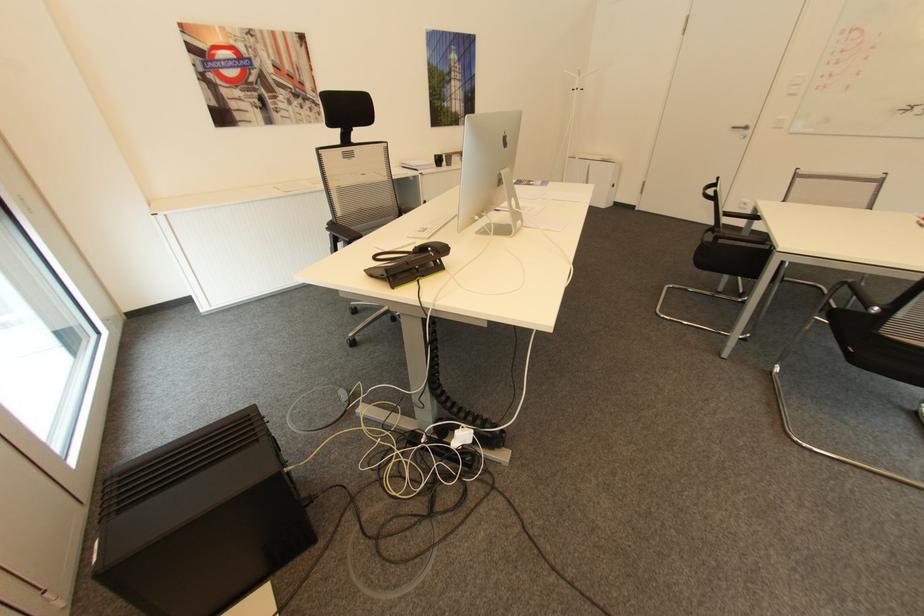
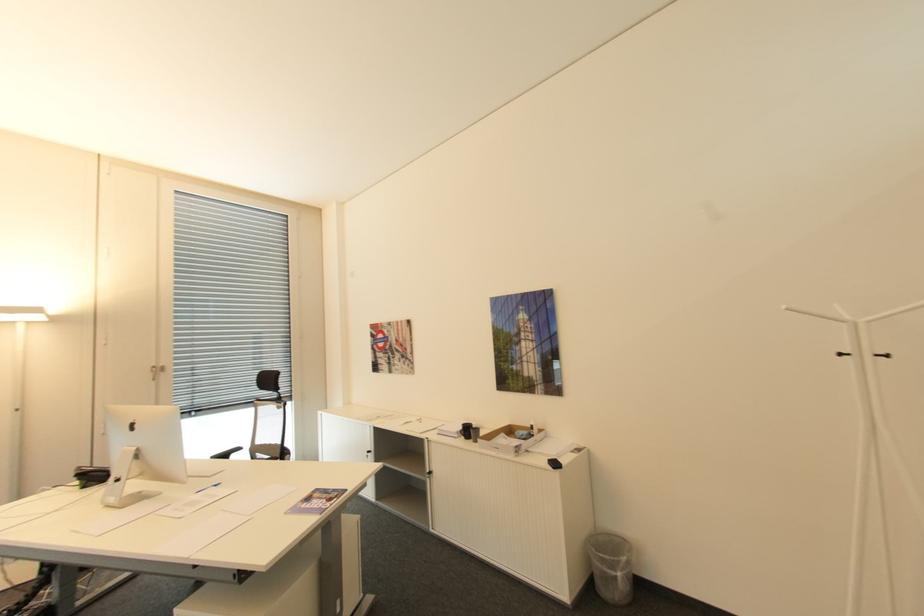
Where in the second image is the point corresponding to point (587, 89) from the first image?

(894, 355)